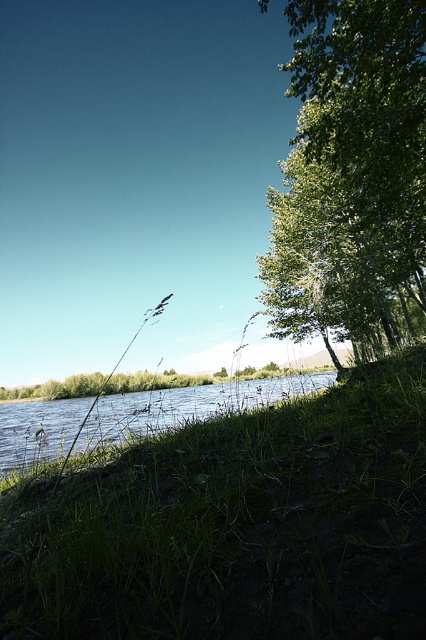
Between green leafy tree at right and green grassy river at lower left, which one has less height?

green grassy river at lower left

Based on the photo, which is more to the left, green leafy tree at right or green grassy river at lower left?

green grassy river at lower left

Is point (328, 100) less distant than point (31, 442)?

Yes, it is in front of point (31, 442).

At what (x,y) coordinates should I click in order to perform the action: click on green leafy tree at right. Please return your answer as a coordinate pair (x, y). This screenshot has width=426, height=640. Looking at the image, I should click on (351, 177).

Does green grass at lower left have a lesser height compared to green grassy river at lower left?

Yes.

Looking at this image, is green grass at lower left in front of green grassy river at lower left?

Yes, it is in front of green grassy river at lower left.

Who is more forward, (163, 490) or (146, 426)?

Point (163, 490)

Where is `green grass at lower left`? Image resolution: width=426 pixels, height=640 pixels. green grass at lower left is located at coordinates (236, 525).

Which of these two, green grass at lower left or green leafy tree at right, stands shorter?

green grass at lower left is shorter.

Does green grass at lower left appear on the left side of green leafy tree at right?

Indeed, green grass at lower left is positioned on the left side of green leafy tree at right.

Is point (196, 464) behind point (420, 227)?

No, it is not.

Where is `green grass at lower left`? Image resolution: width=426 pixels, height=640 pixels. green grass at lower left is located at coordinates (236, 525).